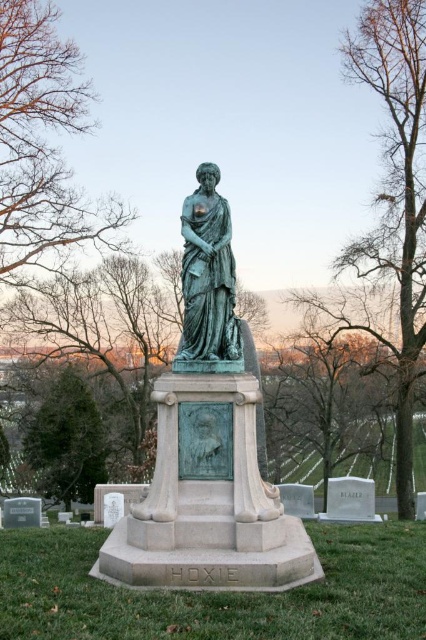
Question: Does green patinated statue at center have a larger size compared to green bronze statue at lower left?

Choices:
 (A) no
 (B) yes

Answer: (B)

Question: Among these points, which one is farthest from the camera?

Choices:
 (A) (42, 422)
 (B) (175, 388)

Answer: (A)

Question: Considering the relative positions of green patina statue at center and brown leafless branches at upper left in the image provided, where is green patina statue at center located with respect to brown leafless branches at upper left?

Choices:
 (A) right
 (B) left

Answer: (A)

Question: Is brown leafless branches at upper left above green patinated statue at center?

Choices:
 (A) no
 (B) yes

Answer: (B)

Question: Which point is closer to the camera?

Choices:
 (A) (244, 566)
 (B) (207, 237)
 (C) (60, 205)

Answer: (A)

Question: Which object appears closest to the camera in this image?

Choices:
 (A) green patina statue at center
 (B) brown leafless branches at upper left
 (C) green patinated statue at center
 (D) green bronze statue at lower left

Answer: (A)